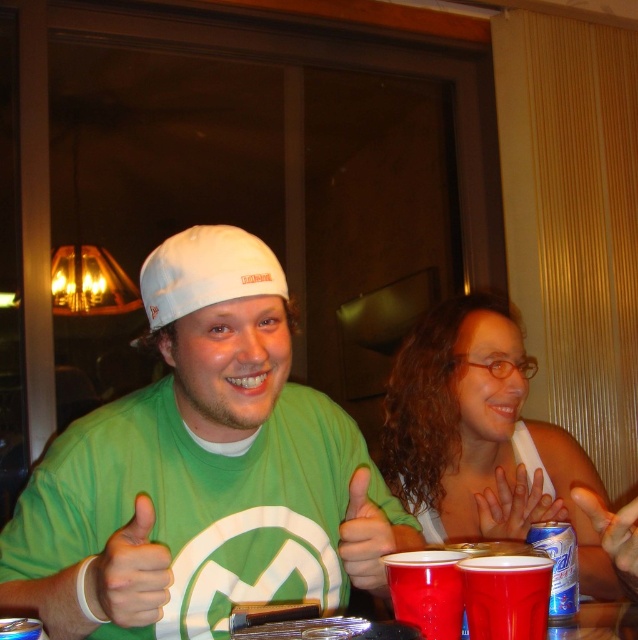
Looking at this image, you are a bartender observing the scene and need to serve drinks. Which object, the matte plastic cup at lower center or the matte plastic hands at center, is located above the other?

The matte plastic cup at lower center is positioned over matte plastic hands at center, so the cup is above the hands.

You are at a party and want to grab a drink. There are two options on the table in front of you. Which one is closer to your right hand if you are facing the table? The red plastic cup at center and the blue metallic can at lower right.

The blue metallic can at lower right is to the right of the red plastic cup at center, so if you are facing the table, the blue metallic can at lower right is closer to your right hand.

You are a bartender at a party and need to place a new drink order on the table. The table has a matte plastic cup at lower center. Where should you place the new drink order so it doesn not interfere with the existing cup?

The matte plastic cup at lower center is located at point (426,589), so you should place the new drink order away from that coordinate to avoid interference.